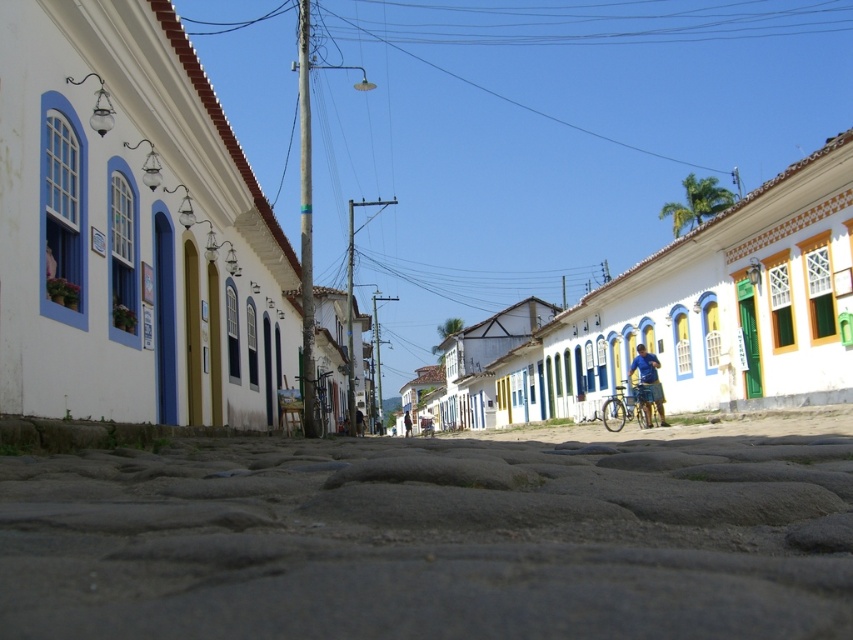
Question: Which object is the farthest from the silver metallic bicycle at center?

Choices:
 (A) gray cobblestone alley at center
 (B) white matte building at center

Answer: (B)

Question: Does white matte building at center have a larger size compared to gray cobblestone alley at center?

Choices:
 (A) yes
 (B) no

Answer: (A)

Question: Estimate the real-world distances between objects in this image. Which object is farther from the silver metallic bicycle at center?

Choices:
 (A) gray cobblestone alley at center
 (B) white matte building at center
 (C) blue fabric shorts at center

Answer: (B)

Question: Which object appears closest to the camera in this image?

Choices:
 (A) silver metallic bicycle at center
 (B) blue fabric shorts at center

Answer: (B)

Question: Does white matte building at center come in front of silver metallic bicycle at center?

Choices:
 (A) yes
 (B) no

Answer: (A)

Question: Is gray cobblestone alley at center smaller than silver metallic bicycle at center?

Choices:
 (A) yes
 (B) no

Answer: (B)